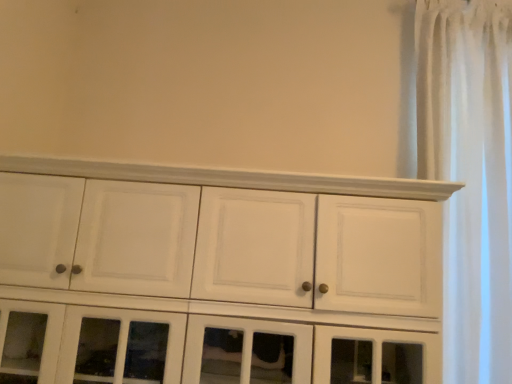
Question: Should I look upward or downward to see white sheer curtain at right?

Choices:
 (A) down
 (B) up

Answer: (B)

Question: From the image's perspective, is white sheer curtain at right located beneath white painted wood cupboard at center?

Choices:
 (A) no
 (B) yes

Answer: (A)

Question: Is white sheer curtain at right smaller than white painted wood cupboard at center?

Choices:
 (A) no
 (B) yes

Answer: (B)

Question: Considering the relative sizes of white sheer curtain at right and white painted wood cupboard at center in the image provided, is white sheer curtain at right shorter than white painted wood cupboard at center?

Choices:
 (A) no
 (B) yes

Answer: (A)

Question: Does white sheer curtain at right have a greater height compared to white painted wood cupboard at center?

Choices:
 (A) yes
 (B) no

Answer: (A)

Question: Is white sheer curtain at right behind white painted wood cupboard at center?

Choices:
 (A) yes
 (B) no

Answer: (A)

Question: Is white sheer curtain at right not near white painted wood cupboard at center?

Choices:
 (A) no
 (B) yes

Answer: (A)

Question: Can you confirm if white painted wood cupboard at center is positioned to the right of white sheer curtain at right?

Choices:
 (A) no
 (B) yes

Answer: (A)

Question: Is white painted wood cupboard at center not near white sheer curtain at right?

Choices:
 (A) no
 (B) yes

Answer: (A)

Question: Can you confirm if white painted wood cupboard at center is wider than white sheer curtain at right?

Choices:
 (A) yes
 (B) no

Answer: (A)

Question: Does white painted wood cupboard at center have a larger size compared to white sheer curtain at right?

Choices:
 (A) yes
 (B) no

Answer: (A)

Question: From the image's perspective, is white painted wood cupboard at center located beneath white sheer curtain at right?

Choices:
 (A) no
 (B) yes

Answer: (B)

Question: Could you tell me if white painted wood cupboard at center is turned towards white sheer curtain at right?

Choices:
 (A) yes
 (B) no

Answer: (B)

Question: Relative to white sheer curtain at right, is white painted wood cupboard at center in front or behind?

Choices:
 (A) behind
 (B) front

Answer: (B)